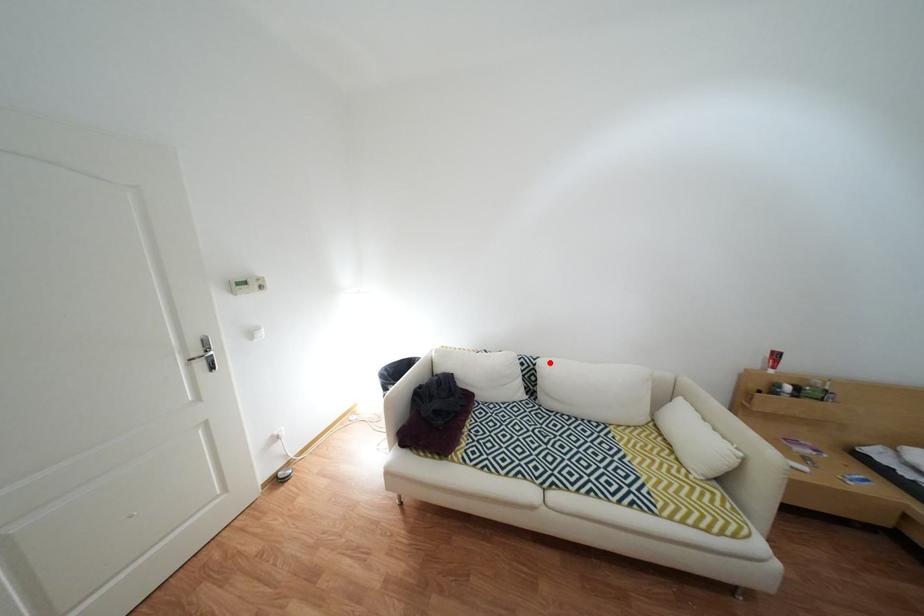
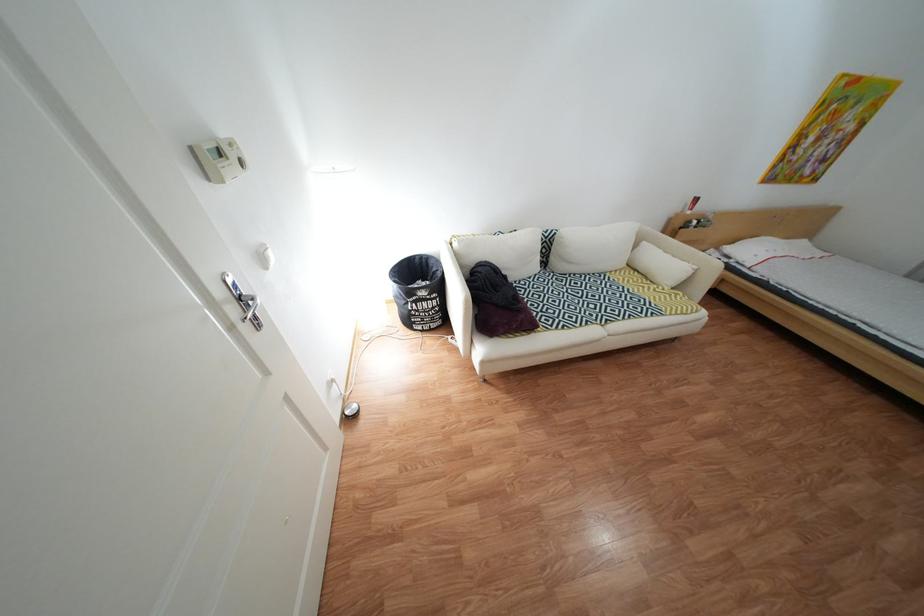
Question: I am providing you with two images of the same scene from different viewpoints. In image1, a red point is highlighted. Considering the same 3D point in image2, which of the following is correct?

Choices:
 (A) It is closer
 (B) It is farther

Answer: (A)